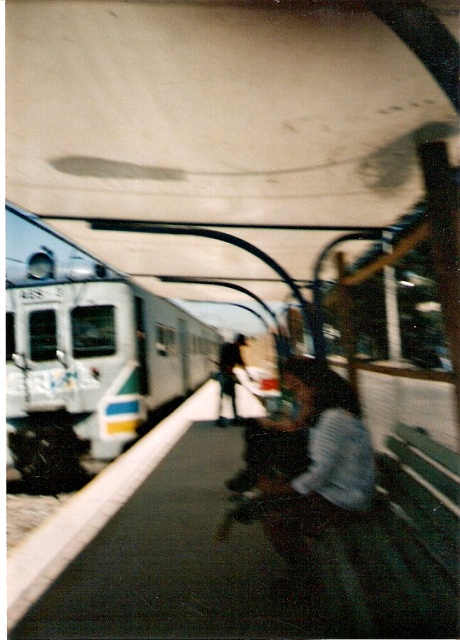
Question: Is silver metallic train at left thinner than dark blue jeans at center?

Choices:
 (A) no
 (B) yes

Answer: (A)

Question: Which of the following is the farthest from the observer?

Choices:
 (A) (224, 340)
 (B) (92, 403)

Answer: (A)

Question: Can you confirm if silver metallic train at left is positioned to the left of dark blue jeans at center?

Choices:
 (A) no
 (B) yes

Answer: (B)

Question: Is silver metallic train at left further to camera compared to dark blue jeans at center?

Choices:
 (A) yes
 (B) no

Answer: (B)

Question: Which of the following is the closest to the observer?

Choices:
 (A) (51, 300)
 (B) (240, 342)

Answer: (A)